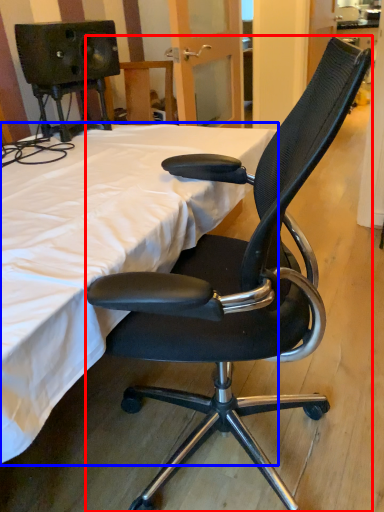
Question: Which object is closer to the camera taking this photo, chair (highlighted by a red box) or bed (highlighted by a blue box)?

Choices:
 (A) chair
 (B) bed

Answer: (A)